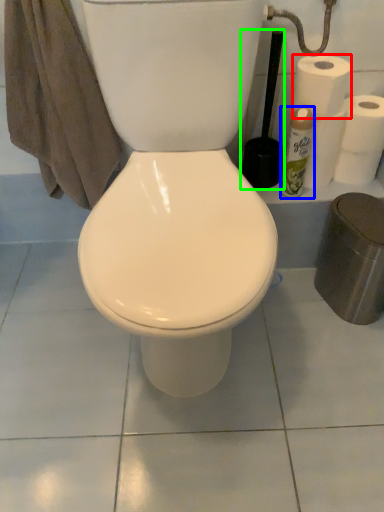
Question: Based on their relative distances, which object is farther from paper towel (highlighted by a red box)? Choose from cleaning product (highlighted by a blue box) and brush (highlighted by a green box).

Choices:
 (A) cleaning product
 (B) brush

Answer: (B)